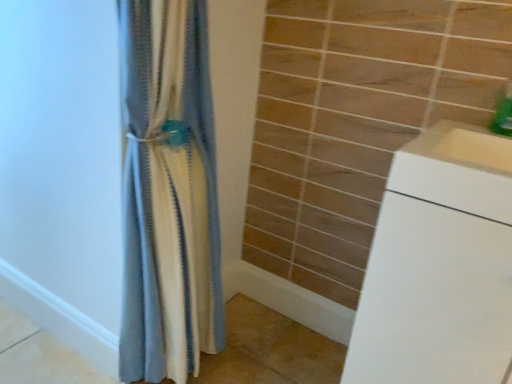
This screenshot has height=384, width=512. Describe the element at coordinates (503, 113) in the screenshot. I see `green plastic soap dispenser at upper right` at that location.

The height and width of the screenshot is (384, 512). What do you see at coordinates (439, 265) in the screenshot? I see `white glossy cabinet at lower right` at bounding box center [439, 265].

The image size is (512, 384). I want to click on blue textured fabric at center, so coord(168,193).

Find the location of a particular element. green plastic soap dispenser at upper right is located at coordinates (503, 113).

Is blue textured fabric at center in contact with green plastic soap dispenser at upper right?

No, blue textured fabric at center is not beside green plastic soap dispenser at upper right.

Considering the sizes of objects blue textured fabric at center and green plastic soap dispenser at upper right in the image provided, who is taller, blue textured fabric at center or green plastic soap dispenser at upper right?

blue textured fabric at center is taller.

Based on their sizes in the image, would you say blue textured fabric at center is bigger or smaller than green plastic soap dispenser at upper right?

blue textured fabric at center is bigger than green plastic soap dispenser at upper right.

How far apart are blue textured fabric at center and green plastic soap dispenser at upper right?

A distance of 35.20 inches exists between blue textured fabric at center and green plastic soap dispenser at upper right.

Based on their positions, is green plastic soap dispenser at upper right located to the left or right of white matte drawer at right?

Clearly, green plastic soap dispenser at upper right is on the right of white matte drawer at right in the image.

Is green plastic soap dispenser at upper right facing away from white matte drawer at right?

No, white matte drawer at right is not at the back of green plastic soap dispenser at upper right.

Between green plastic soap dispenser at upper right and white matte drawer at right, which one has smaller size?

Smaller between the two is green plastic soap dispenser at upper right.

Between blue textured fabric at center and white glossy cabinet at lower right, which one is positioned behind?

blue textured fabric at center.

Locate an element on the screen. Image resolution: width=512 pixels, height=384 pixels. curtain behind the white glossy cabinet at lower right is located at coordinates (168, 193).

Based on the photo, are blue textured fabric at center and white glossy cabinet at lower right making contact?

There is a gap between blue textured fabric at center and white glossy cabinet at lower right.

From a real-world perspective, which object rests below the other?

white glossy cabinet at lower right.

How much distance is there between blue textured fabric at center and white matte drawer at right?

The distance of blue textured fabric at center from white matte drawer at right is 24.69 inches.

Can you confirm if blue textured fabric at center is thinner than white matte drawer at right?

Yes.

Could white matte drawer at right be considered to be inside blue textured fabric at center?

No.

Does point (133, 154) lie behind point (496, 212)?

Yes, it is behind point (496, 212).

In the scene shown: Considering the relative sizes of white matte drawer at right and white glossy cabinet at lower right in the image provided, is white matte drawer at right wider than white glossy cabinet at lower right?

No.

Is white matte drawer at right not close to white glossy cabinet at lower right?

No, there isn't a large distance between white matte drawer at right and white glossy cabinet at lower right.

Locate an element on the screen. This screenshot has height=384, width=512. drawer on the left of white glossy cabinet at lower right is located at coordinates (452, 186).

From the picture: Is white matte drawer at right outside of white glossy cabinet at lower right?

Yes, white matte drawer at right is not within white glossy cabinet at lower right.

Which is correct: white glossy cabinet at lower right is inside green plastic soap dispenser at upper right, or outside of it?

white glossy cabinet at lower right cannot be found inside green plastic soap dispenser at upper right.

Could you tell me if white glossy cabinet at lower right is turned towards green plastic soap dispenser at upper right?

No.

From the picture: From the image's perspective, does white glossy cabinet at lower right appear lower than green plastic soap dispenser at upper right?

Indeed, from the image's perspective, white glossy cabinet at lower right is shown beneath green plastic soap dispenser at upper right.

How many degrees apart are the facing directions of white glossy cabinet at lower right and green plastic soap dispenser at upper right?

The angular difference between white glossy cabinet at lower right and green plastic soap dispenser at upper right is 2.1 degrees.

Is green plastic soap dispenser at upper right not near blue textured fabric at center?

No, green plastic soap dispenser at upper right is not far from blue textured fabric at center.

Locate an element on the screen. The height and width of the screenshot is (384, 512). soap dispenser that is on the right side of blue textured fabric at center is located at coordinates click(x=503, y=113).

Does point (507, 110) come behind point (167, 300)?

No, it is not.

You are a GUI agent. You are given a task and a screenshot of the screen. Output one action in this format:
    pyautogui.click(x=<x>, y=<y>)
    Task: Click on the curtain below the green plastic soap dispenser at upper right (from the image's perspective)
    The height and width of the screenshot is (384, 512).
    Given the screenshot: What is the action you would take?
    pyautogui.click(x=168, y=193)

Identify the location of soap dispenser positioned vertically above the white matte drawer at right (from a real-world perspective). This screenshot has width=512, height=384. (503, 113).

Considering their positions, is white glossy cabinet at lower right positioned closer to white matte drawer at right than blue textured fabric at center?

Among the two, white glossy cabinet at lower right is located nearer to white matte drawer at right.

Looking at the image, which one is located further to blue textured fabric at center, white matte drawer at right or white glossy cabinet at lower right?

Among the two, white matte drawer at right is located further to blue textured fabric at center.

Estimate the real-world distances between objects in this image. Which object is further from blue textured fabric at center, green plastic soap dispenser at upper right or white matte drawer at right?

green plastic soap dispenser at upper right lies further to blue textured fabric at center than the other object.

Considering their positions, is white matte drawer at right positioned closer to blue textured fabric at center than green plastic soap dispenser at upper right?

white matte drawer at right is positioned closer to the anchor blue textured fabric at center.

Based on their spatial positions, is white glossy cabinet at lower right or green plastic soap dispenser at upper right further from white matte drawer at right?

green plastic soap dispenser at upper right is positioned further to the anchor white matte drawer at right.

Estimate the real-world distances between objects in this image. Which object is further from green plastic soap dispenser at upper right, white glossy cabinet at lower right or blue textured fabric at center?

Among the two, blue textured fabric at center is located further to green plastic soap dispenser at upper right.

Which object lies further to the anchor point white glossy cabinet at lower right, green plastic soap dispenser at upper right or blue textured fabric at center?

blue textured fabric at center is positioned further to the anchor white glossy cabinet at lower right.

Based on their spatial positions, is blue textured fabric at center or white matte drawer at right closer to green plastic soap dispenser at upper right?

Based on the image, white matte drawer at right appears to be nearer to green plastic soap dispenser at upper right.

Locate an element on the screen. The width and height of the screenshot is (512, 384). drawer located between blue textured fabric at center and green plastic soap dispenser at upper right in the left-right direction is located at coordinates (452, 186).

Locate an element on the screen. drawer situated between blue textured fabric at center and white glossy cabinet at lower right from left to right is located at coordinates (452, 186).

Find the location of `drawer between green plastic soap dispenser at upper right and white glossy cabinet at lower right vertically`. drawer between green plastic soap dispenser at upper right and white glossy cabinet at lower right vertically is located at coordinates (452, 186).

The image size is (512, 384). I want to click on counter between blue textured fabric at center and green plastic soap dispenser at upper right in the horizontal direction, so click(x=439, y=265).